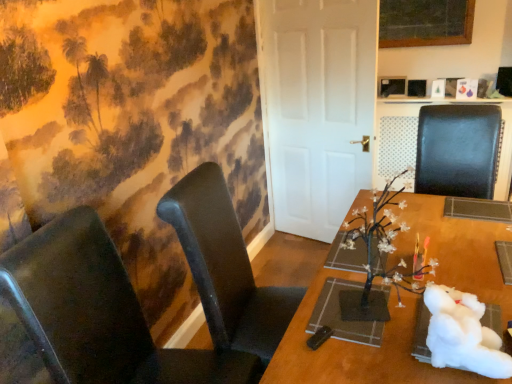
The width and height of the screenshot is (512, 384). In order to click on empty space that is ontop of wooden table at center (from a real-world perspective) in this screenshot , I will do `click(422, 266)`.